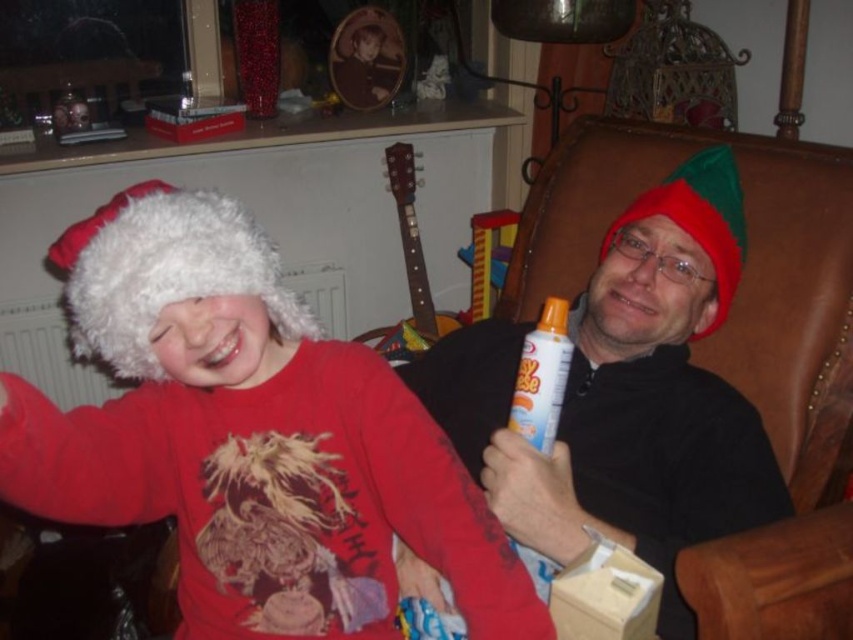
Between point (310, 387) and point (635, 355), which one is positioned behind?

The point (635, 355) is behind.

Find the location of a particular element. This screenshot has height=640, width=853. fuzzy white hat at left is located at coordinates (248, 436).